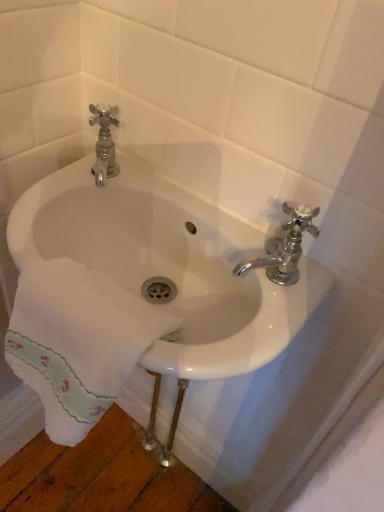
Find the location of a particular element. This screenshot has height=512, width=384. empty space that is ontop of white embroidered towel at lower left (from a real-world perspective) is located at coordinates (72, 301).